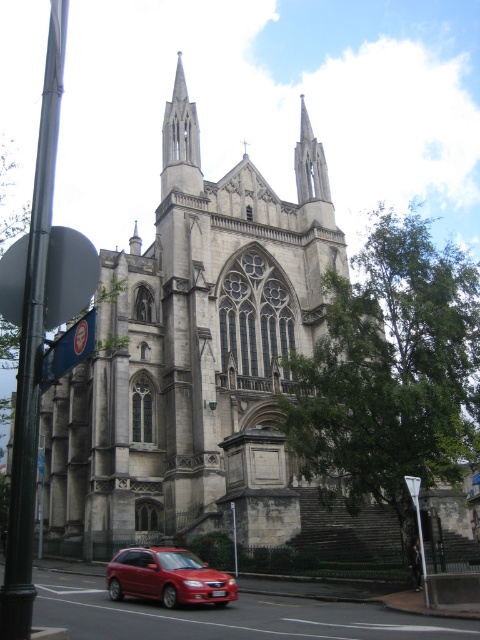
Between shiny red sedan at lower center and smooth stone spire at upper center, which one has less height?

shiny red sedan at lower center

Based on the photo, between shiny red sedan at lower center and smooth stone spire at upper center, which one is positioned lower?

A: shiny red sedan at lower center is lower down.

What do you see at coordinates (168, 577) in the screenshot? I see `shiny red sedan at lower center` at bounding box center [168, 577].

Locate an element on the screen. This screenshot has width=480, height=640. shiny red sedan at lower center is located at coordinates (168, 577).